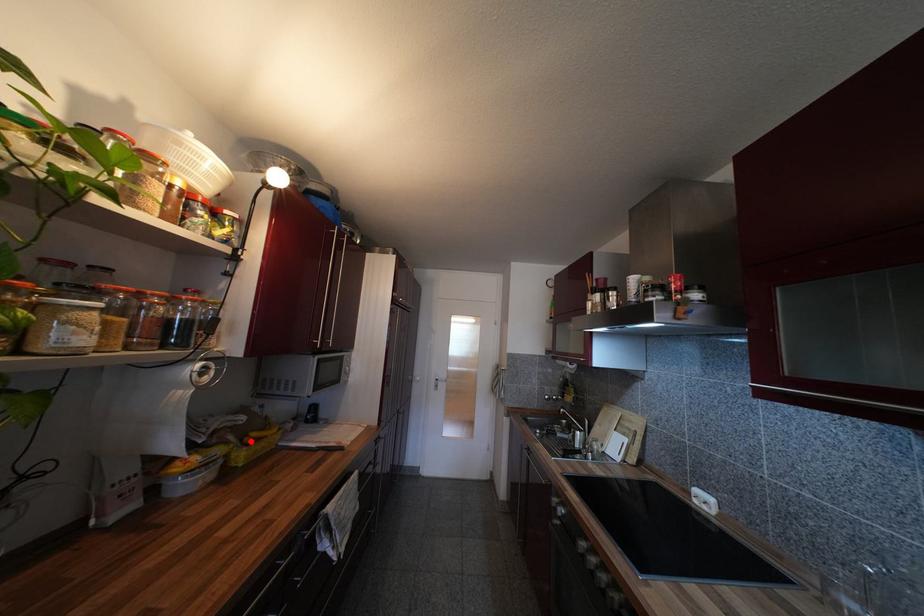
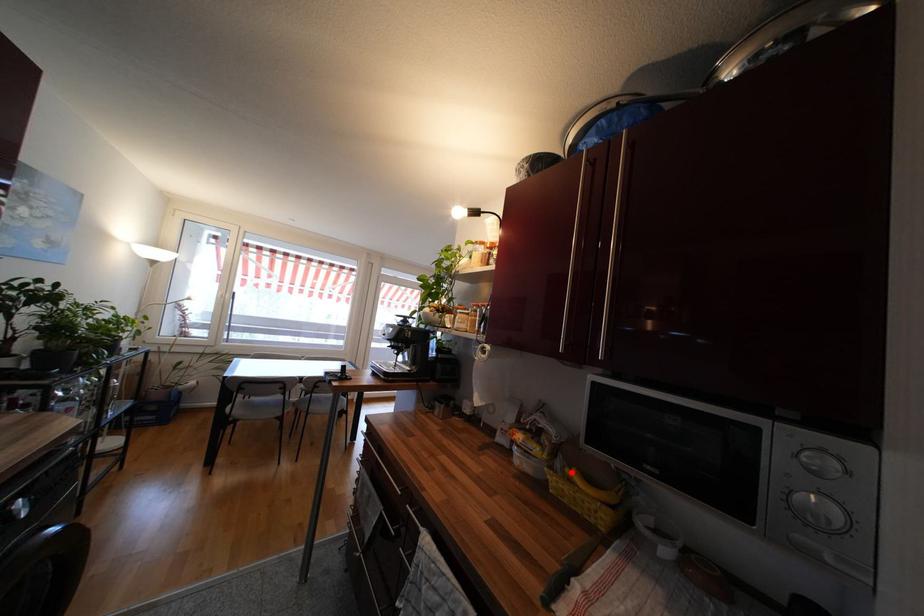
I am providing you with two images of the same scene from different viewpoints. A red point is marked on the first image and another point is marked on the second image. Does the point marked in image1 correspond to the same location as the one in image2?

Yes